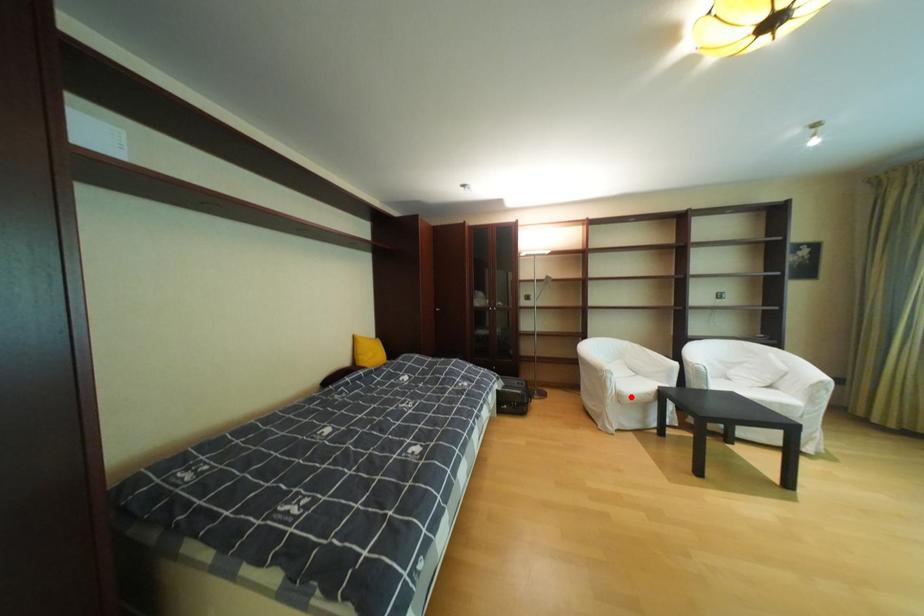
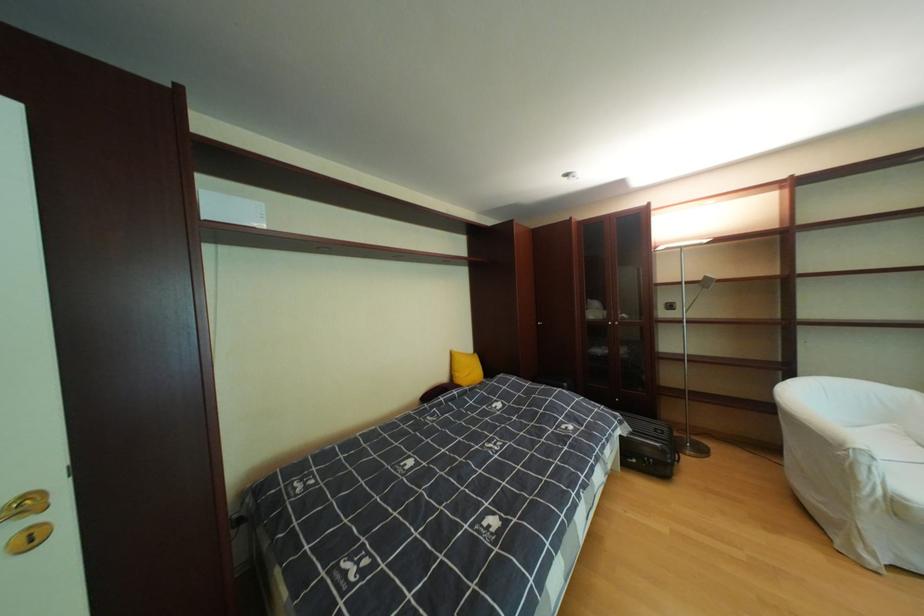
In the second image, find the point that corresponds to the highlighted location in the first image.

(908, 506)